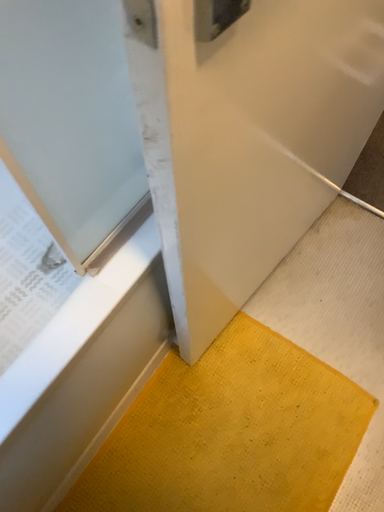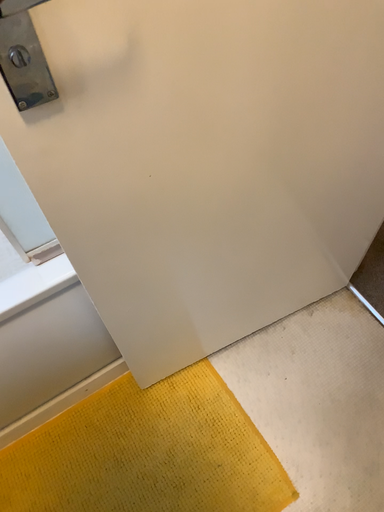
Question: Which way did the camera rotate in the video?

Choices:
 (A) rotated downward
 (B) rotated upward

Answer: (B)